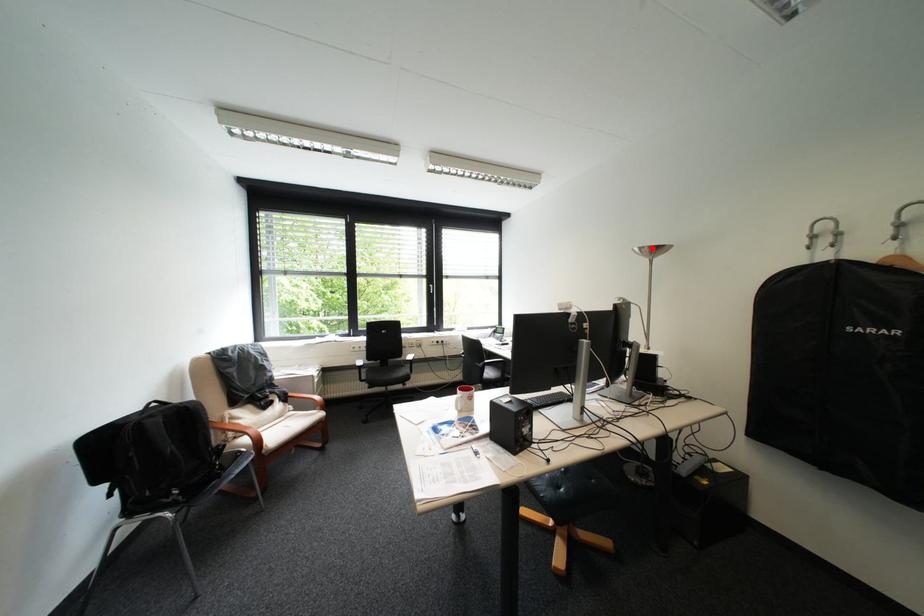
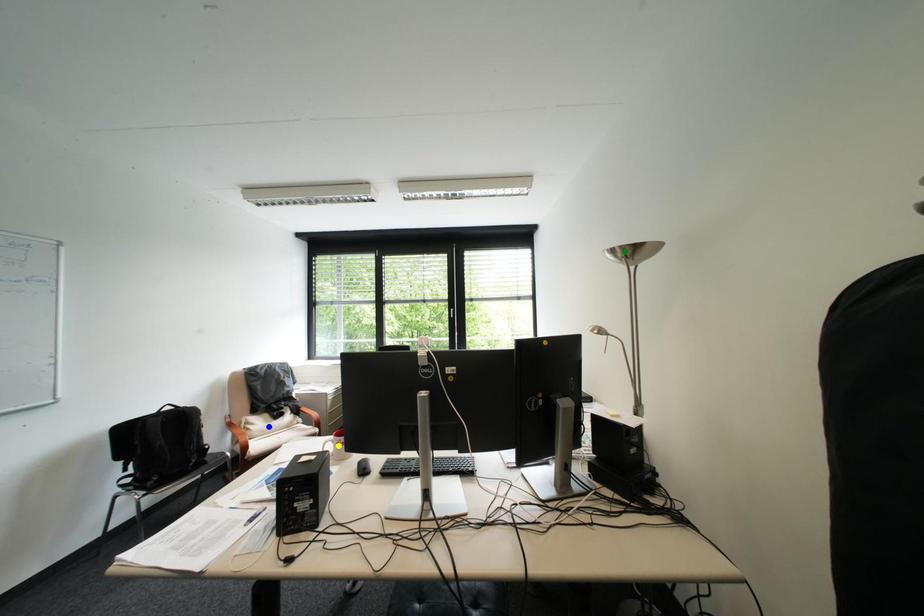
Question: I am providing you with two images of the same scene from different viewpoints. A red point is marked on the first image. You are given multiple points on the second image. Which mark in image 2 goes with the point in image 1?

Choices:
 (A) green point
 (B) blue point
 (C) yellow point

Answer: (A)